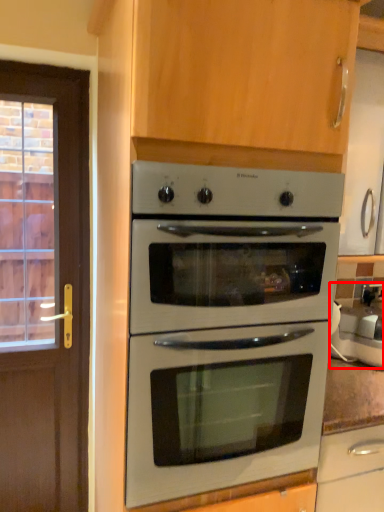
Question: From the image's perspective, what is the correct spatial positioning of appliance (annotated by the red box) in reference to oven?

Choices:
 (A) above
 (B) below

Answer: (B)